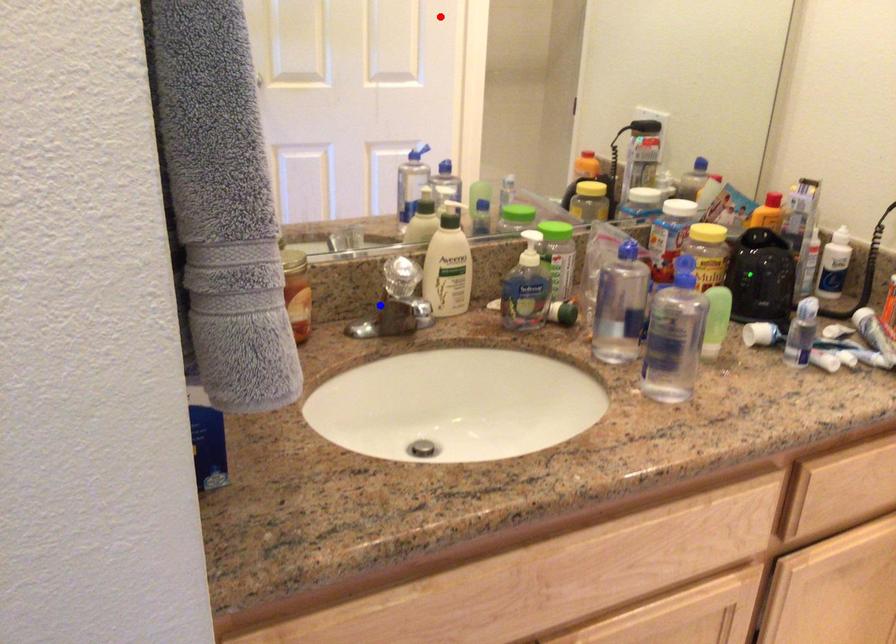
Question: Two points are marked on the image. Which point is closer to the camera?

Choices:
 (A) Blue point is closer.
 (B) Red point is closer.

Answer: (A)